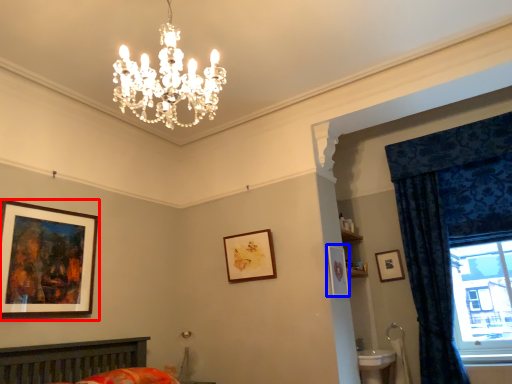
Question: Which object is further to the camera taking this photo, picture frame (highlighted by a red box) or picture frame (highlighted by a blue box)?

Choices:
 (A) picture frame
 (B) picture frame

Answer: (B)